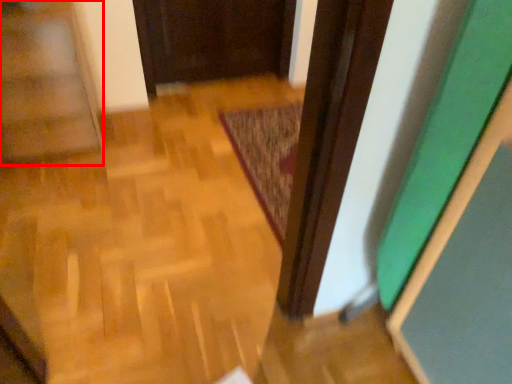
Question: From the image's perspective, where is stairwell (annotated by the red box) located in relation to mat in the image?

Choices:
 (A) above
 (B) below

Answer: (A)